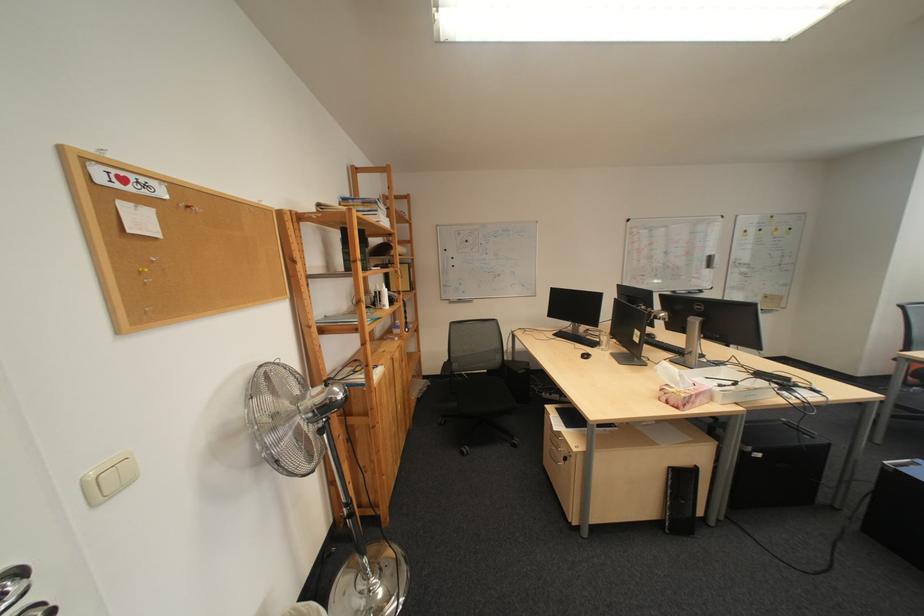
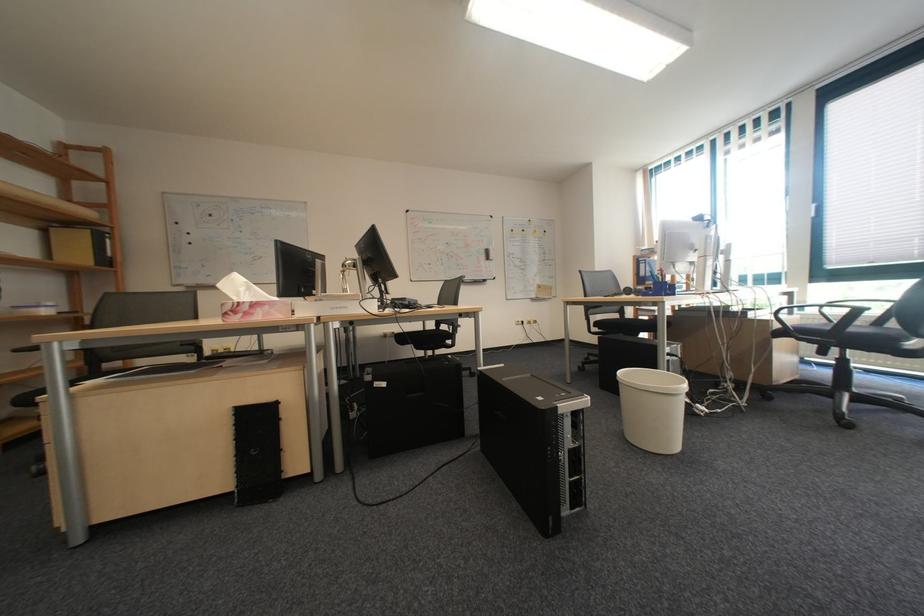
The point at (773, 456) is marked in the first image. Where is the corresponding point in the second image?

(398, 386)